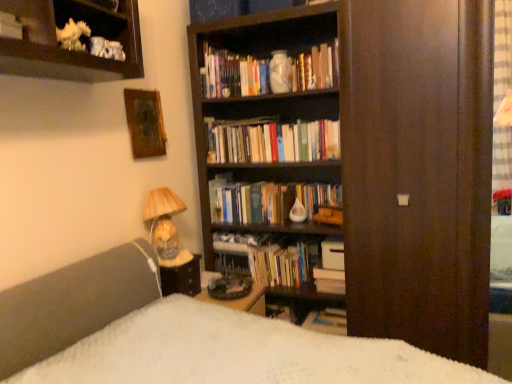
Question: Is matte ceramic lamp at lower left to the left of porcelain vase at upper center from the viewer's perspective?

Choices:
 (A) no
 (B) yes

Answer: (B)

Question: Is matte ceramic lamp at lower left positioned with its back to porcelain vase at upper center?

Choices:
 (A) yes
 (B) no

Answer: (B)

Question: Is matte ceramic lamp at lower left with porcelain vase at upper center?

Choices:
 (A) yes
 (B) no

Answer: (B)

Question: Is matte ceramic lamp at lower left smaller than porcelain vase at upper center?

Choices:
 (A) yes
 (B) no

Answer: (B)

Question: Considering the relative sizes of matte ceramic lamp at lower left and porcelain vase at upper center in the image provided, is matte ceramic lamp at lower left wider than porcelain vase at upper center?

Choices:
 (A) yes
 (B) no

Answer: (A)

Question: Does matte ceramic lamp at lower left appear on the right side of porcelain vase at upper center?

Choices:
 (A) yes
 (B) no

Answer: (B)

Question: Does hardcover books at center, arranged as the second book when ordered from the bottom, have a smaller size compared to matte ceramic lamp at lower left?

Choices:
 (A) no
 (B) yes

Answer: (B)

Question: Is hardcover books at center, the fifth book from the top, oriented away from matte ceramic lamp at lower left?

Choices:
 (A) yes
 (B) no

Answer: (B)

Question: Does hardcover books at center, the fifth book from the top, appear on the right side of matte ceramic lamp at lower left?

Choices:
 (A) no
 (B) yes

Answer: (B)

Question: From a real-world perspective, is hardcover books at center, arranged as the second book when ordered from the bottom, positioned over matte ceramic lamp at lower left based on gravity?

Choices:
 (A) no
 (B) yes

Answer: (A)

Question: Is hardcover books at center, arranged as the second book when ordered from the bottom, to the left of matte ceramic lamp at lower left from the viewer's perspective?

Choices:
 (A) yes
 (B) no

Answer: (B)

Question: Does hardcover books at center, arranged as the second book when ordered from the bottom, have a greater width compared to matte ceramic lamp at lower left?

Choices:
 (A) yes
 (B) no

Answer: (B)

Question: Is wooden desk at center in contact with matte brown table at lower left?

Choices:
 (A) no
 (B) yes

Answer: (A)